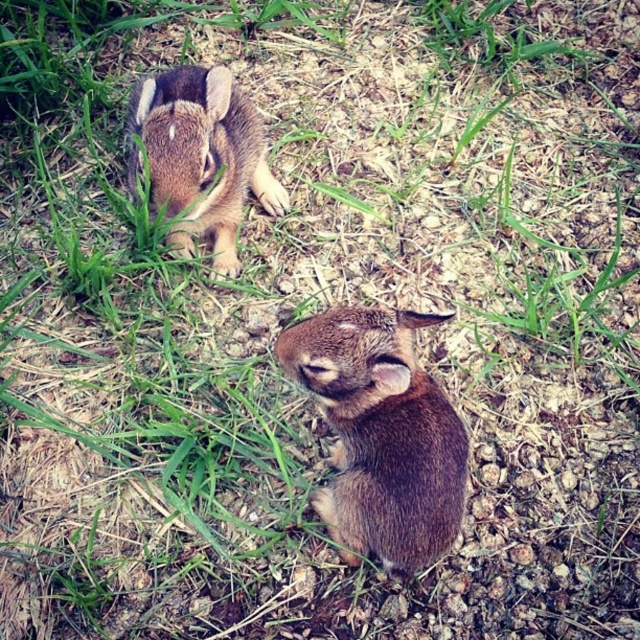
You are standing at the origin point in the image coordinate system. The image coordinate system has the origin at the bottom left corner. Where is the brown furry rabbit at center located in 2D coordinates?

The brown furry rabbit at center is located at 2D coordinates point (381, 435).

You are standing in the field where the two rabbits are. You want to throw a small carrot to the closest point between point (x=460, y=508) and point (x=145, y=97). Which point should you aim for?

Point (x=460, y=508) is closer to the viewer than point (x=145, y=97), so you should aim for point (x=460, y=508).

You are a wildlife photographer trying to capture both rabbits in a single shot. Given that your camera frame can only accommodate objects of the same size, will the brown furry rabbit at center and the brown furry rabbit at upper left fit together in the frame?

The brown furry rabbit at center is smaller than the brown furry rabbit at upper left, so they are not the same size. Therefore, they might not fit together in the camera frame designed for objects of the same size.